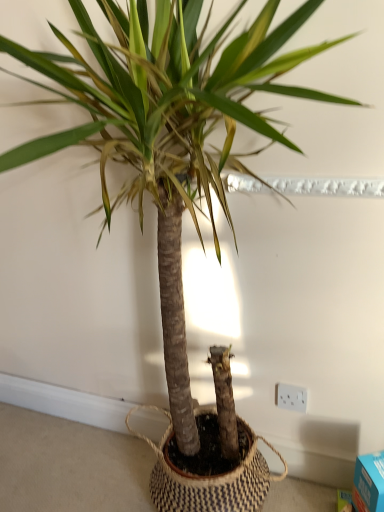
Question: Would you say white plastic electric outlet at lower right is inside or outside blue cardboard box at lower right?

Choices:
 (A) inside
 (B) outside

Answer: (B)

Question: Is point (279, 397) positioned closer to the camera than point (377, 497)?

Choices:
 (A) farther
 (B) closer

Answer: (A)

Question: In the image, is white plastic electric outlet at lower right positioned in front of or behind blue cardboard box at lower right?

Choices:
 (A) behind
 (B) front

Answer: (A)

Question: Is blue cardboard box at lower right wider or thinner than white plastic electric outlet at lower right?

Choices:
 (A) thin
 (B) wide

Answer: (B)

Question: From the image's perspective, is blue cardboard box at lower right located above or below white plastic electric outlet at lower right?

Choices:
 (A) below
 (B) above

Answer: (A)

Question: From their relative heights in the image, would you say blue cardboard box at lower right is taller or shorter than white plastic electric outlet at lower right?

Choices:
 (A) short
 (B) tall

Answer: (B)

Question: Considering the positions of blue cardboard box at lower right and white plastic electric outlet at lower right in the image, is blue cardboard box at lower right bigger or smaller than white plastic electric outlet at lower right?

Choices:
 (A) small
 (B) big

Answer: (B)